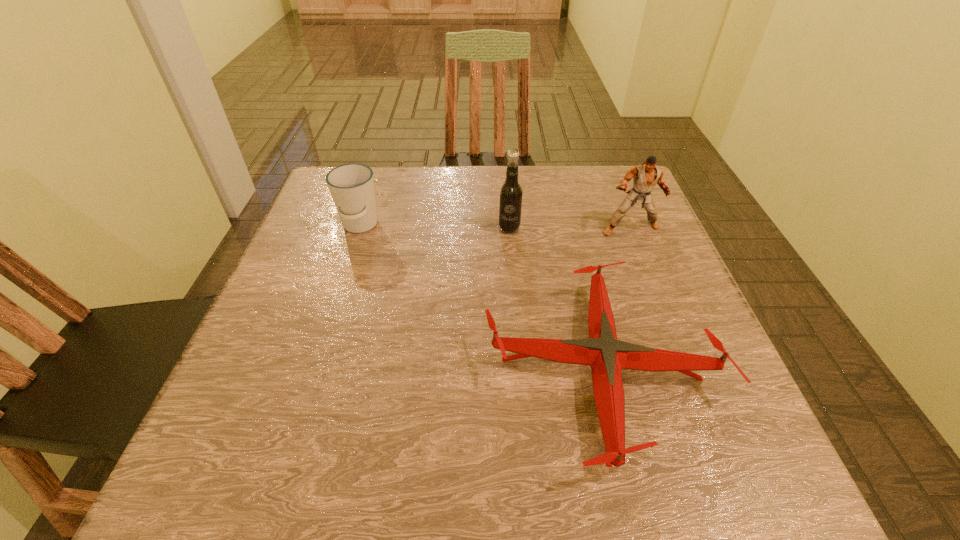
Locate an element on the screen. The height and width of the screenshot is (540, 960). vacant area that lies between the puncher and the leftmost object is located at coordinates (495, 227).

This screenshot has width=960, height=540. I want to click on free spot between the leftmost object and the puncher, so click(x=495, y=227).

Find the location of a particular element. This screenshot has height=540, width=960. object that is the second closest to the root beer is located at coordinates (645, 176).

This screenshot has height=540, width=960. What are the coordinates of `object that is the second closest one to the root beer` in the screenshot? It's located at (645, 176).

Identify the location of free space that satisfies the following two spatial constraints: 1. with a handle on the side of the third tallest object; 2. on the right side of the drone. Image resolution: width=960 pixels, height=540 pixels. (314, 369).

The image size is (960, 540). I want to click on blank area in the image that satisfies the following two spatial constraints: 1. with a handle on the side of the second shortest object; 2. on the left side of the shortest object, so click(314, 369).

Image resolution: width=960 pixels, height=540 pixels. What are the coordinates of `vacant area in the image that satisfies the following two spatial constraints: 1. on the label of the shortest object; 2. on the left side of the root beer` in the screenshot? It's located at (520, 369).

Where is `free region that satisfies the following two spatial constraints: 1. on the label of the shortest object; 2. on the left side of the root beer`? Image resolution: width=960 pixels, height=540 pixels. free region that satisfies the following two spatial constraints: 1. on the label of the shortest object; 2. on the left side of the root beer is located at coordinates (520, 369).

At what (x,y) coordinates should I click in order to perform the action: click on free region that satisfies the following two spatial constraints: 1. with a handle on the side of the second shortest object; 2. on the right side of the nearest object. Please return your answer as a coordinate pair (x, y). This screenshot has width=960, height=540. Looking at the image, I should click on (314, 369).